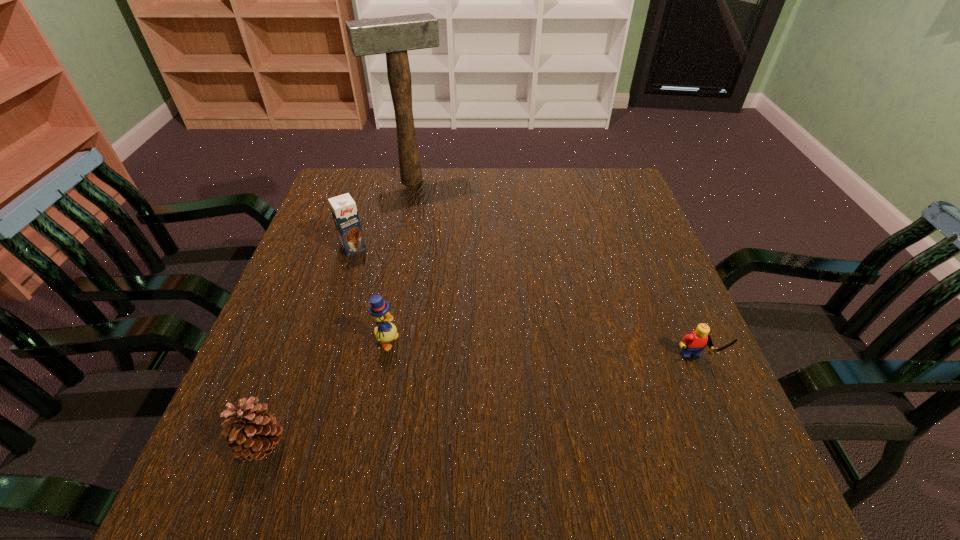
At what (x,y) coordinates should I click in order to perform the action: click on free space at the far right corner. Please return your answer as a coordinate pair (x, y). Image resolution: width=960 pixels, height=540 pixels. Looking at the image, I should click on (589, 213).

This screenshot has height=540, width=960. In the image, there is a desktop. In order to click on vacant space at the near right corner in this screenshot , I will do `click(745, 438)`.

Identify the location of free space between the fourth nearest object and the mallet. The height and width of the screenshot is (540, 960). pyautogui.click(x=382, y=214).

This screenshot has height=540, width=960. What are the coordinates of `empty space that is in between the fourth nearest object and the rightmost object` in the screenshot? It's located at (524, 307).

This screenshot has width=960, height=540. I want to click on vacant area that lies between the tallest object and the Lego, so click(x=553, y=273).

Image resolution: width=960 pixels, height=540 pixels. Find the location of `blank region between the pinecone and the duckling`. blank region between the pinecone and the duckling is located at coordinates (324, 394).

In order to click on vacant point located between the fourth nearest object and the rightmost object in this screenshot , I will do `click(524, 307)`.

Where is `free space that is in between the Lego and the farthest object`? The height and width of the screenshot is (540, 960). free space that is in between the Lego and the farthest object is located at coordinates (553, 273).

The width and height of the screenshot is (960, 540). I want to click on free space between the nearest object and the tallest object, so click(337, 313).

At what (x,y) coordinates should I click in order to perform the action: click on free point between the pinecone and the second farthest object. Please return your answer as a coordinate pair (x, y). Looking at the image, I should click on (308, 347).